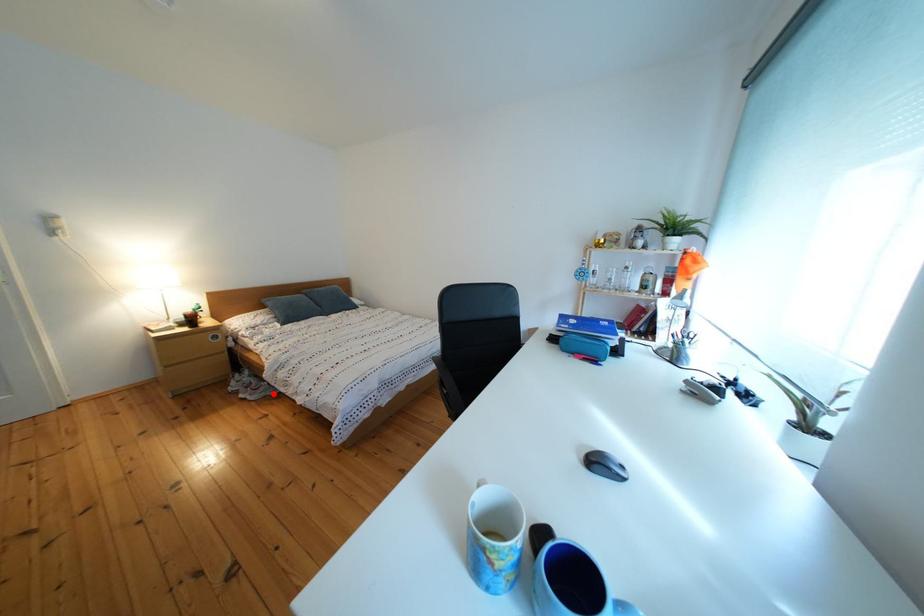
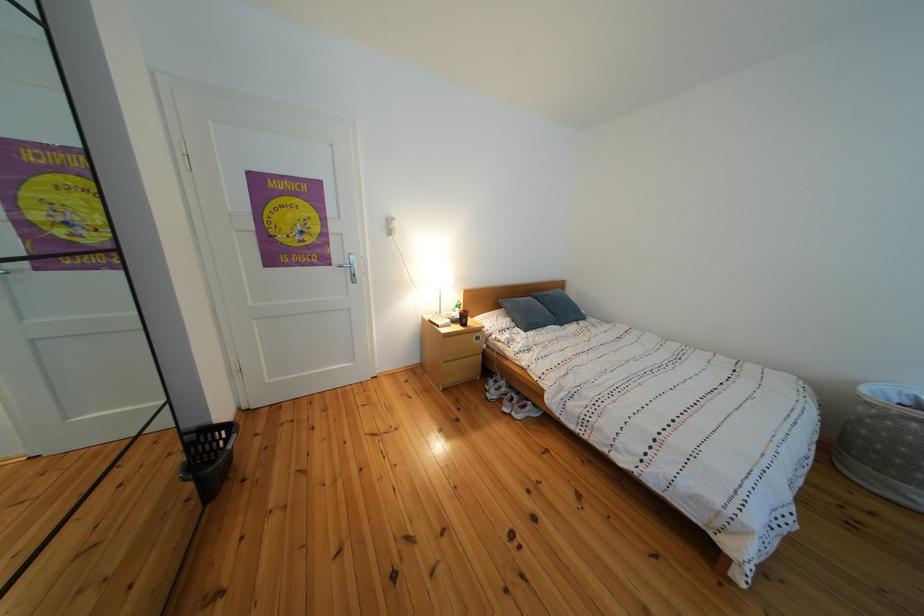
Question: A red point is marked in image1. In image2, is the corresponding 3D point closer to the camera or farther? Reply with the corresponding letter.

Choices:
 (A) The corresponding 3D point is closer.
 (B) The corresponding 3D point is farther.

Answer: (A)